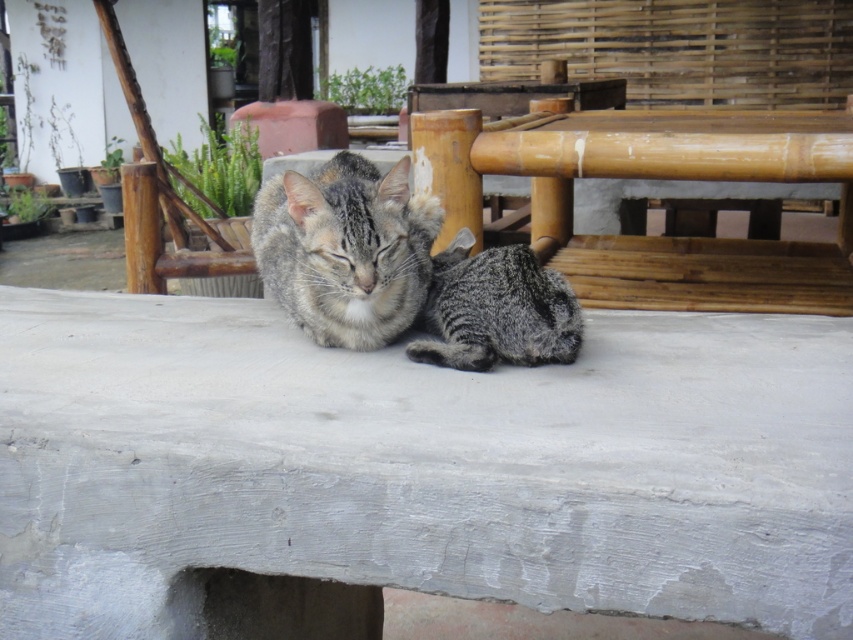
You are a delivery robot with a 30 cm wide package. You need to move from the gray concrete at center to the gray fur cat at center. Is there enough space between them to pass through?

The distance between the gray concrete at center and gray fur cat at center is 47.07 centimeters. Since the package is 30 cm wide, there is enough space to pass through as 47.07 cm is greater than 30 cm.

You are standing at point (459,264) and want to walk to point (647,252). Which direction should you face to move towards your destination?

You should face north because point (647,252) is behind point (459,264), indicating it is in the northern direction.